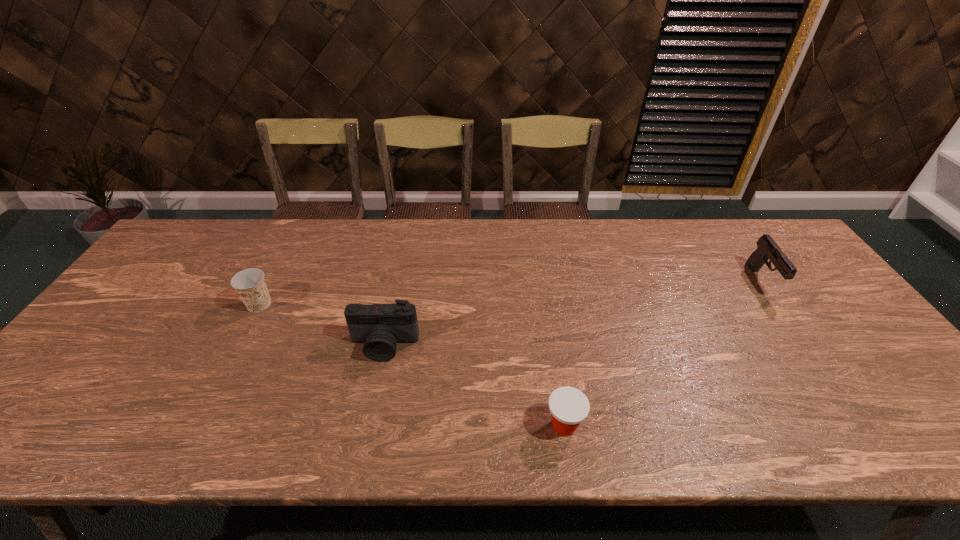
The height and width of the screenshot is (540, 960). What are the coordinates of `the rightmost object` in the screenshot? It's located at (767, 248).

This screenshot has height=540, width=960. Find the location of `camera`. camera is located at coordinates (380, 327).

At what (x,y) coordinates should I click in order to perform the action: click on the third farthest object. Please return your answer as a coordinate pair (x, y). This screenshot has width=960, height=540. Looking at the image, I should click on (380, 327).

Identify the location of the leftmost object. (250, 285).

Locate an element on the screen. Image resolution: width=960 pixels, height=540 pixels. the left Dixie cup is located at coordinates (250, 285).

Find the location of a particular element. The image size is (960, 540). the shorter Dixie cup is located at coordinates (569, 407).

You are a GUI agent. You are given a task and a screenshot of the screen. Output one action in this format:
    pyautogui.click(x=<x>, y=<y>)
    Task: Click on the nearer Dixie cup
    
    Given the screenshot: What is the action you would take?
    pyautogui.click(x=569, y=407)

The height and width of the screenshot is (540, 960). I want to click on vacant space located aim along the barrel of the pistol, so click(802, 336).

This screenshot has width=960, height=540. I want to click on vacant space situated 0.140m at the lens of the third object from right to left, so click(371, 413).

The image size is (960, 540). Identify the location of vacant position located on the left of the leftmost object. (220, 305).